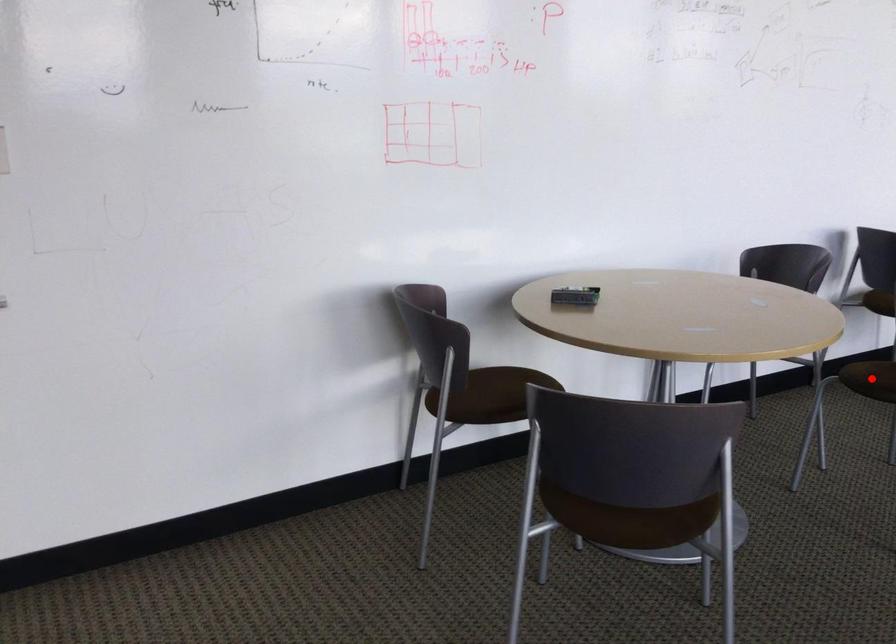
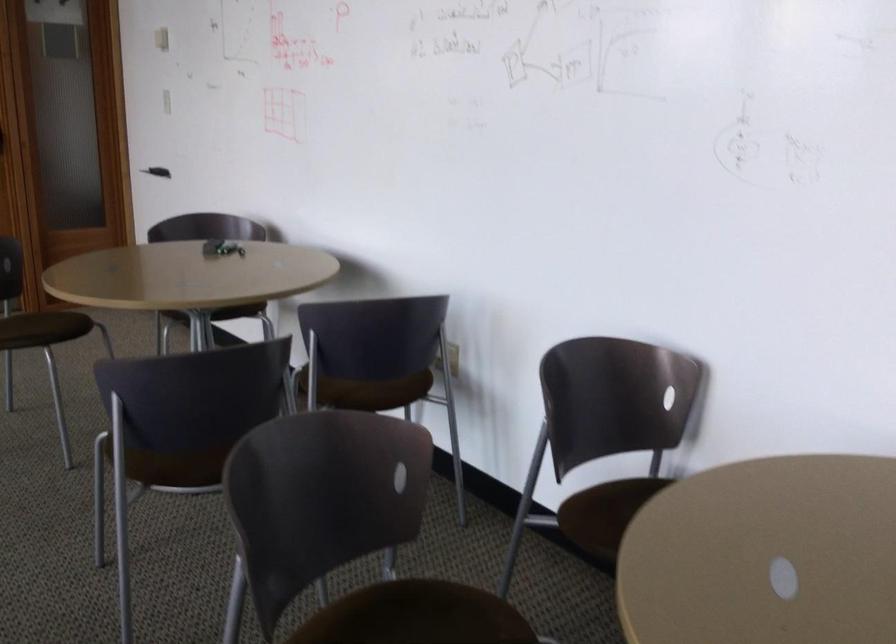
Question: I am providing you with two images of the same scene from different viewpoints. A red point is marked on the first image. Can you still see the location of the red point in image 2?

Choices:
 (A) Yes
 (B) No

Answer: (B)